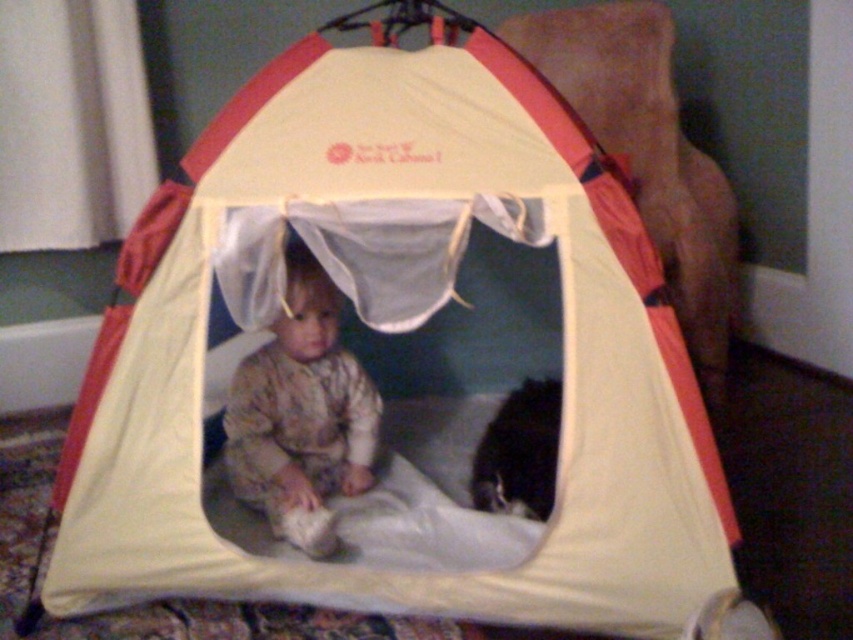
Who is shorter, camouflage fabric child at center or black fur cat at lower right?

With less height is black fur cat at lower right.

The image size is (853, 640). What do you see at coordinates (300, 413) in the screenshot? I see `camouflage fabric child at center` at bounding box center [300, 413].

Locate an element on the screen. The height and width of the screenshot is (640, 853). camouflage fabric child at center is located at coordinates (300, 413).